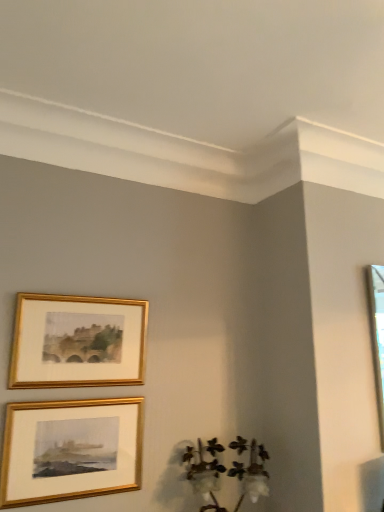
Locate an element on the screen. The width and height of the screenshot is (384, 512). gold/glossy picture frame at lower left, positioned as the 1th picture frame in bottom-to-top order is located at coordinates (70, 450).

Describe the element at coordinates (205, 473) in the screenshot. The image size is (384, 512). I see `white cotton at lower right` at that location.

The height and width of the screenshot is (512, 384). What are the coordinates of `white cotton at lower right` in the screenshot? It's located at (205, 473).

The height and width of the screenshot is (512, 384). What are the coordinates of `gold/glossy picture frame at lower left, positioned as the 1th picture frame in bottom-to-top order` in the screenshot? It's located at (70, 450).

What are the coordinates of `picture frame above the gold/glossy picture frame at lower left, positioned as the 1th picture frame in bottom-to-top order (from the image's perspective)` in the screenshot? It's located at (77, 341).

Which object is thinner, gold/gilded picture frame at upper left, which is counted as the second picture frame, starting from the bottom, or gold/glossy picture frame at lower left, positioned as the 1th picture frame in bottom-to-top order?

With smaller width is gold/glossy picture frame at lower left, positioned as the 1th picture frame in bottom-to-top order.

In the scene shown: Can you confirm if gold/gilded picture frame at upper left, which is counted as the second picture frame, starting from the bottom, is smaller than gold/glossy picture frame at lower left, which appears as the second picture frame when viewed from the top?

Incorrect, gold/gilded picture frame at upper left, which is counted as the second picture frame, starting from the bottom, is not smaller in size than gold/glossy picture frame at lower left, which appears as the second picture frame when viewed from the top.

Who is shorter, gold/gilded picture frame at upper left, placed as the 1th picture frame when sorted from top to bottom, or gold/glossy picture frame at lower left, which appears as the second picture frame when viewed from the top?

With less height is gold/gilded picture frame at upper left, placed as the 1th picture frame when sorted from top to bottom.

Which of these two, white cotton at lower right or gold/gilded picture frame at upper left, which is counted as the second picture frame, starting from the bottom, stands shorter?

Standing shorter between the two is white cotton at lower right.

Which is in front, white cotton at lower right or gold/gilded picture frame at upper left, which is counted as the second picture frame, starting from the bottom?

Positioned in front is white cotton at lower right.

Find the location of a particular element. the 2nd picture frame above when counting from the white cotton at lower right (from the image's perspective) is located at coordinates (77, 341).

Is white cotton at lower right not close to gold/gilded picture frame at upper left, placed as the 1th picture frame when sorted from top to bottom?

That's not correct — white cotton at lower right is a little close to gold/gilded picture frame at upper left, placed as the 1th picture frame when sorted from top to bottom.

From a real-world perspective, is gold/glossy picture frame at lower left, positioned as the 1th picture frame in bottom-to-top order, physically above gold/gilded picture frame at upper left, which is counted as the second picture frame, starting from the bottom?

No, from a real-world perspective, gold/glossy picture frame at lower left, positioned as the 1th picture frame in bottom-to-top order, is not on top of gold/gilded picture frame at upper left, which is counted as the second picture frame, starting from the bottom.

Between gold/glossy picture frame at lower left, which appears as the second picture frame when viewed from the top, and gold/gilded picture frame at upper left, placed as the 1th picture frame when sorted from top to bottom, which one has larger size?

Bigger between the two is gold/gilded picture frame at upper left, placed as the 1th picture frame when sorted from top to bottom.

How much distance is there between gold/glossy picture frame at lower left, positioned as the 1th picture frame in bottom-to-top order, and gold/gilded picture frame at upper left, which is counted as the second picture frame, starting from the bottom?

A distance of 8.56 inches exists between gold/glossy picture frame at lower left, positioned as the 1th picture frame in bottom-to-top order, and gold/gilded picture frame at upper left, which is counted as the second picture frame, starting from the bottom.

Is gold/glossy picture frame at lower left, positioned as the 1th picture frame in bottom-to-top order, next to gold/gilded picture frame at upper left, placed as the 1th picture frame when sorted from top to bottom, and touching it?

No, gold/glossy picture frame at lower left, positioned as the 1th picture frame in bottom-to-top order, is not beside gold/gilded picture frame at upper left, placed as the 1th picture frame when sorted from top to bottom.

Considering the positions of points (83, 301) and (191, 459), is point (83, 301) closer to camera compared to point (191, 459)?

Yes, point (83, 301) is in front of point (191, 459).

From the image's perspective, would you say gold/gilded picture frame at upper left, placed as the 1th picture frame when sorted from top to bottom, is positioned over white cotton at lower right?

Correct, gold/gilded picture frame at upper left, placed as the 1th picture frame when sorted from top to bottom, appears higher than white cotton at lower right in the image.

Would you say white cotton at lower right contains gold/glossy picture frame at lower left, which appears as the second picture frame when viewed from the top?

That's incorrect, gold/glossy picture frame at lower left, which appears as the second picture frame when viewed from the top, is not inside white cotton at lower right.

Which is closer to the camera, (204, 490) or (25, 432)?

Point (204, 490) is positioned farther from the camera compared to point (25, 432).

Does white cotton at lower right turn towards gold/glossy picture frame at lower left, which appears as the second picture frame when viewed from the top?

No.

From a real-world perspective, which is physically below, gold/glossy picture frame at lower left, positioned as the 1th picture frame in bottom-to-top order, or white cotton at lower right?

From a 3D spatial view, white cotton at lower right is below.

What's the angular difference between gold/glossy picture frame at lower left, which appears as the second picture frame when viewed from the top, and white cotton at lower right's facing directions?

The angular difference between gold/glossy picture frame at lower left, which appears as the second picture frame when viewed from the top, and white cotton at lower right is 0.629 degrees.

From the image's perspective, is gold/glossy picture frame at lower left, positioned as the 1th picture frame in bottom-to-top order, located above or below white cotton at lower right?

gold/glossy picture frame at lower left, positioned as the 1th picture frame in bottom-to-top order, is above white cotton at lower right.

I want to click on picture frame above the gold/glossy picture frame at lower left, positioned as the 1th picture frame in bottom-to-top order (from a real-world perspective), so click(x=77, y=341).

Locate an element on the screen. The height and width of the screenshot is (512, 384). plant located underneath the gold/gilded picture frame at upper left, which is counted as the second picture frame, starting from the bottom (from a real-world perspective) is located at coordinates (205, 473).

Based on their spatial positions, is white cotton at lower right or gold/glossy picture frame at lower left, positioned as the 1th picture frame in bottom-to-top order, closer to gold/gilded picture frame at upper left, placed as the 1th picture frame when sorted from top to bottom?

gold/glossy picture frame at lower left, positioned as the 1th picture frame in bottom-to-top order, lies closer to gold/gilded picture frame at upper left, placed as the 1th picture frame when sorted from top to bottom, than the other object.

Based on their spatial positions, is gold/glossy picture frame at lower left, positioned as the 1th picture frame in bottom-to-top order, or white cotton at lower right closer to gold/gilded picture frame at upper left, which is counted as the second picture frame, starting from the bottom?

gold/glossy picture frame at lower left, positioned as the 1th picture frame in bottom-to-top order, lies closer to gold/gilded picture frame at upper left, which is counted as the second picture frame, starting from the bottom, than the other object.

From the image, which object appears to be nearer to gold/glossy picture frame at lower left, which appears as the second picture frame when viewed from the top, gold/gilded picture frame at upper left, which is counted as the second picture frame, starting from the bottom, or white cotton at lower right?

Among the two, gold/gilded picture frame at upper left, which is counted as the second picture frame, starting from the bottom, is located nearer to gold/glossy picture frame at lower left, which appears as the second picture frame when viewed from the top.

When comparing their distances from white cotton at lower right, does gold/glossy picture frame at lower left, which appears as the second picture frame when viewed from the top, or gold/gilded picture frame at upper left, which is counted as the second picture frame, starting from the bottom, seem closer?

gold/glossy picture frame at lower left, which appears as the second picture frame when viewed from the top.

Which object lies nearer to the anchor point white cotton at lower right, gold/gilded picture frame at upper left, placed as the 1th picture frame when sorted from top to bottom, or gold/glossy picture frame at lower left, positioned as the 1th picture frame in bottom-to-top order?

Based on the image, gold/glossy picture frame at lower left, positioned as the 1th picture frame in bottom-to-top order, appears to be nearer to white cotton at lower right.

Based on their spatial positions, is white cotton at lower right or gold/gilded picture frame at upper left, which is counted as the second picture frame, starting from the bottom, closer to gold/glossy picture frame at lower left, which appears as the second picture frame when viewed from the top?

Among the two, gold/gilded picture frame at upper left, which is counted as the second picture frame, starting from the bottom, is located nearer to gold/glossy picture frame at lower left, which appears as the second picture frame when viewed from the top.

What are the coordinates of `picture frame located between gold/glossy picture frame at lower left, positioned as the 1th picture frame in bottom-to-top order, and white cotton at lower right in the left-right direction` in the screenshot? It's located at (77, 341).